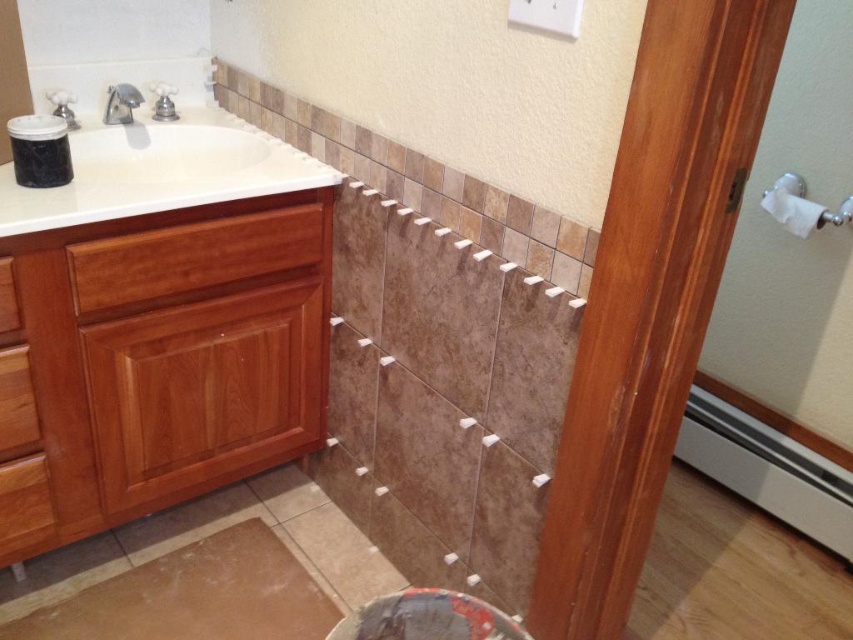
Does point (149, 182) come in front of point (107, 109)?

Yes, it is.

From the picture: Is white glossy sink at upper left positioned behind silver metallic faucet at upper left?

No, white glossy sink at upper left is in front of silver metallic faucet at upper left.

Is point (247, 164) less distant than point (112, 108)?

No, it is behind (112, 108).

Locate an element on the screen. The width and height of the screenshot is (853, 640). white glossy sink at upper left is located at coordinates (165, 154).

Which is in front, point (418, 600) or point (129, 106)?

Point (418, 600)

Does smooth dark red stool at lower center have a lesser height compared to silver metallic faucet at upper left?

Correct, smooth dark red stool at lower center is not as tall as silver metallic faucet at upper left.

This screenshot has height=640, width=853. Find the location of `smooth dark red stool at lower center`. smooth dark red stool at lower center is located at coordinates (427, 618).

Who is positioned more to the left, white glossy sink at upper left or smooth dark red stool at lower center?

white glossy sink at upper left is more to the left.

Measure the distance between point (106, 147) and camera.

The distance of point (106, 147) from camera is 1.67 meters.

Where is `white glossy sink at upper left`? The height and width of the screenshot is (640, 853). white glossy sink at upper left is located at coordinates (165, 154).